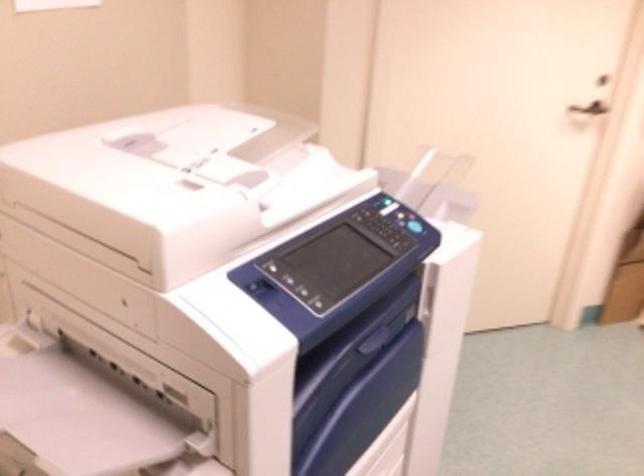
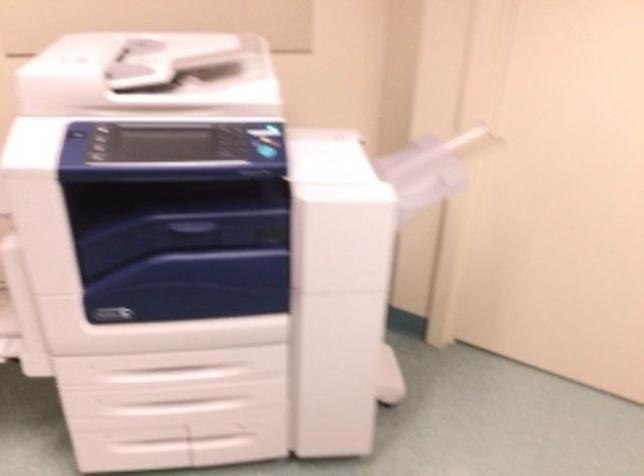
Find the pixel in the second image that matches the point at 102,164 in the first image.

(122, 54)